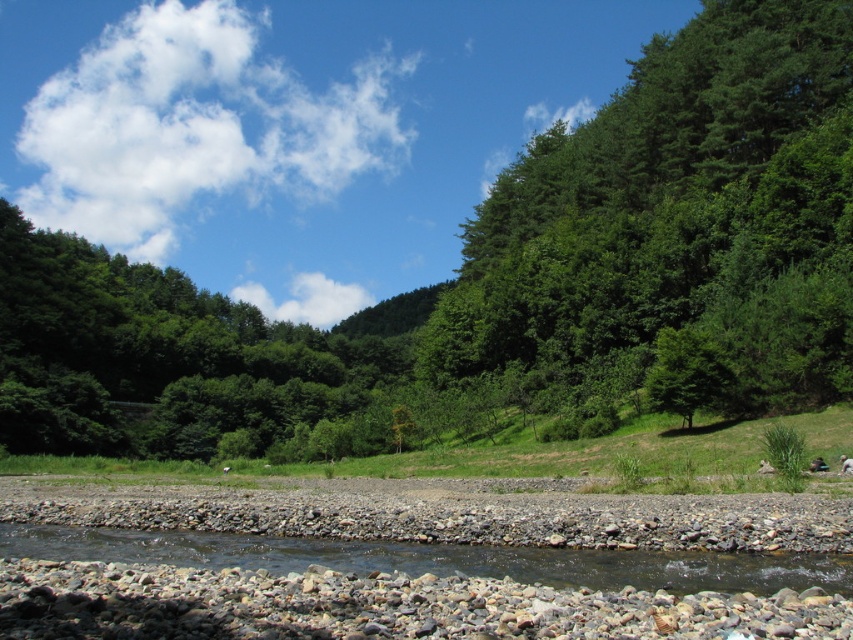
Can you confirm if green leafy forest at center is wider than gray gravel riverbed at lower center?

Indeed, green leafy forest at center has a greater width compared to gray gravel riverbed at lower center.

Between green leafy forest at center and gray gravel riverbed at lower center, which one appears on the right side from the viewer's perspective?

gray gravel riverbed at lower center

Does point (619, 259) come farther from viewer compared to point (6, 612)?

That is True.

Where is `green leafy forest at center`? Image resolution: width=853 pixels, height=640 pixels. green leafy forest at center is located at coordinates (502, 278).

Is green leafy tree at upper right bigger than smooth gravel river at lower center?

Indeed, green leafy tree at upper right has a larger size compared to smooth gravel river at lower center.

Is green leafy tree at upper right further to the viewer compared to smooth gravel river at lower center?

Yes, green leafy tree at upper right is further from the viewer.

Between point (706, 221) and point (537, 566), which one is positioned in front?

Point (537, 566) is in front.

Locate an element on the screen. Image resolution: width=853 pixels, height=640 pixels. green leafy tree at upper right is located at coordinates (679, 214).

Who is shorter, gray gravel riverbed at lower center or smooth gravel river at lower center?

Standing shorter between the two is smooth gravel river at lower center.

Who is lower down, gray gravel riverbed at lower center or smooth gravel river at lower center?

smooth gravel river at lower center

Who is more forward, (x=47, y=604) or (x=142, y=538)?

Point (x=47, y=604) is more forward.

I want to click on gray gravel riverbed at lower center, so click(x=376, y=605).